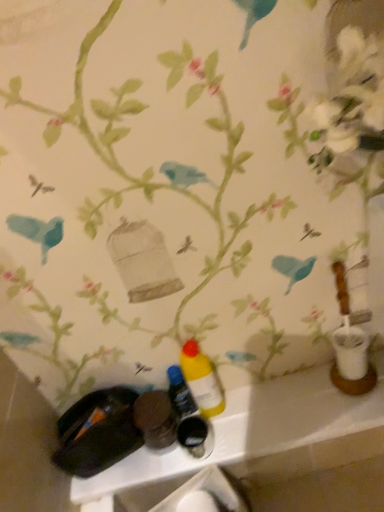
Find the location of a particular element. empty space that is ontop of matte plastic bottles at lower center (from a real-world perspective) is located at coordinates (253, 419).